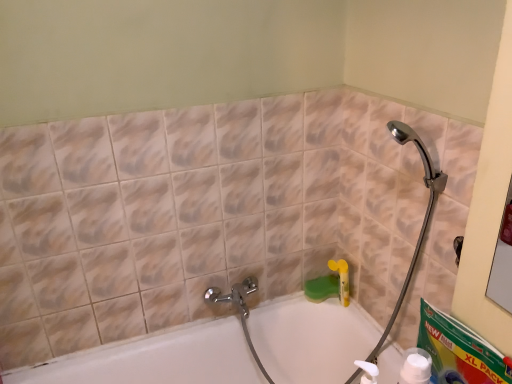
Question: In terms of width, does white plastic bottle at lower right look wider or thinner when compared to white glossy bathtub at center?

Choices:
 (A) thin
 (B) wide

Answer: (A)

Question: In terms of size, does white plastic bottle at lower right appear bigger or smaller than white glossy bathtub at center?

Choices:
 (A) small
 (B) big

Answer: (A)

Question: Is white plastic bottle at lower right spatially inside white glossy bathtub at center, or outside of it?

Choices:
 (A) outside
 (B) inside

Answer: (A)

Question: From a real-world perspective, is white glossy bathtub at center above or below white plastic bottle at lower right?

Choices:
 (A) above
 (B) below

Answer: (B)

Question: Choose the correct answer: Is white glossy bathtub at center inside white plastic bottle at lower right or outside it?

Choices:
 (A) outside
 (B) inside

Answer: (A)

Question: Is white glossy bathtub at center bigger or smaller than white plastic bottle at lower right?

Choices:
 (A) small
 (B) big

Answer: (B)

Question: Based on their positions, is white glossy bathtub at center located to the left or right of white plastic bottle at lower right?

Choices:
 (A) right
 (B) left

Answer: (B)